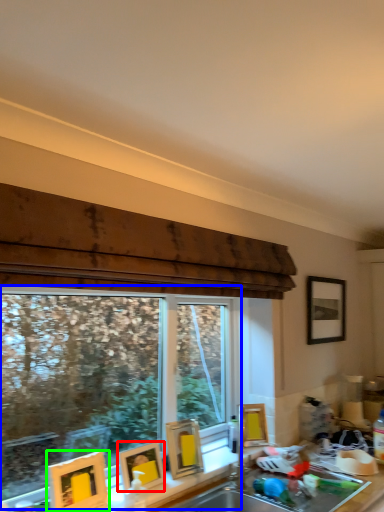
Question: Which object is positioned farthest from picture frame (highlighted by a red box)? Select from window (highlighted by a blue box) and picture frame (highlighted by a green box).

Choices:
 (A) window
 (B) picture frame

Answer: (A)